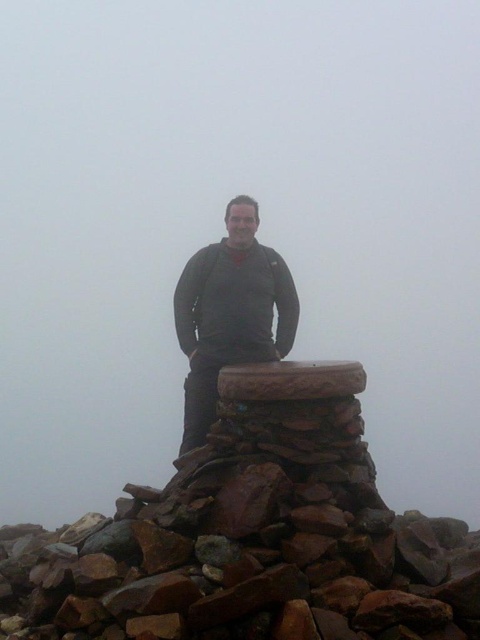
Is brown rough stone at center wider than matte gray sweater at center?

Indeed, brown rough stone at center has a greater width compared to matte gray sweater at center.

Who is taller, brown rough stone at center or matte gray sweater at center?

matte gray sweater at center

Where is `brown rough stone at center`? Image resolution: width=480 pixels, height=640 pixels. brown rough stone at center is located at coordinates (252, 536).